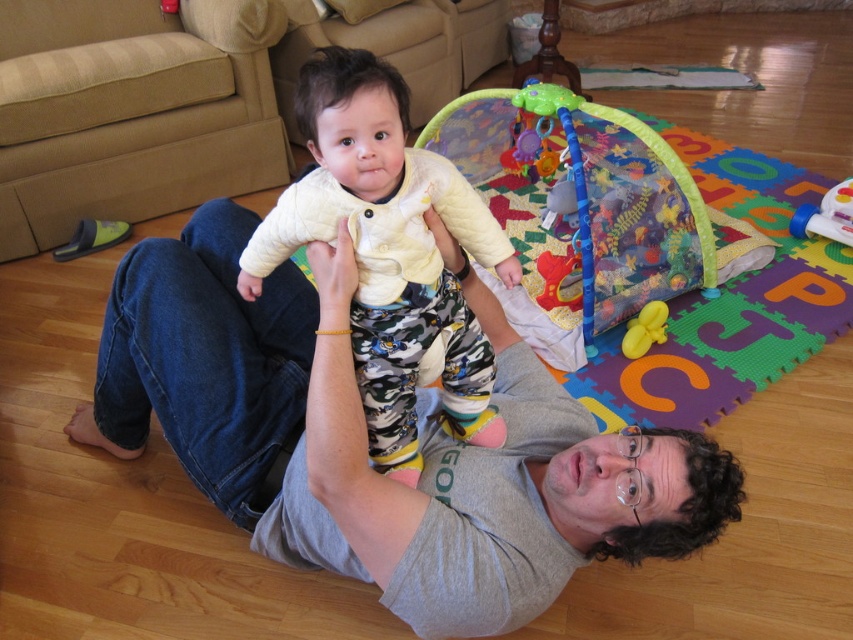
Question: Which of the following is the closest to the observer?

Choices:
 (A) quilted yellow jacket at center
 (B) gray cotton shirt at center
 (C) translucent plastic toy at upper right

Answer: (A)

Question: Which point is farther to the camera?

Choices:
 (A) gray cotton shirt at center
 (B) yellow rubber duck at center
 (C) quilted yellow jacket at center
 (D) multicolored foam mat at center

Answer: (B)

Question: Does multicolored foam mat at center appear over yellow rubber duck at center?

Choices:
 (A) yes
 (B) no

Answer: (A)

Question: Can you confirm if translucent plastic toy at upper right is positioned above yellow rubber duck at center?

Choices:
 (A) no
 (B) yes

Answer: (B)

Question: Estimate the real-world distances between objects in this image. Which object is farther from the multicolored foam mat at center?

Choices:
 (A) translucent plastic toy at upper right
 (B) quilted yellow jacket at center
 (C) gray cotton shirt at center
 (D) yellow rubber duck at center

Answer: (B)

Question: Is gray cotton shirt at center to the right of yellow rubber duck at center from the viewer's perspective?

Choices:
 (A) yes
 (B) no

Answer: (B)